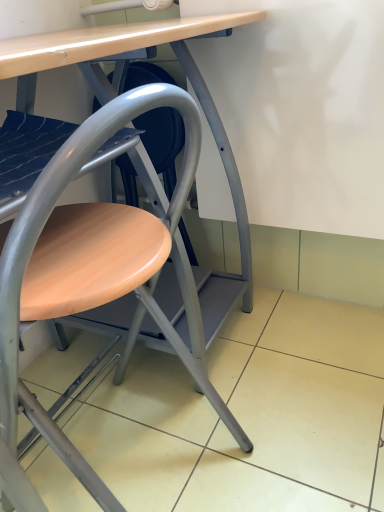
Question: Should I look upward or downward to see wooden seat at center?

Choices:
 (A) down
 (B) up

Answer: (A)